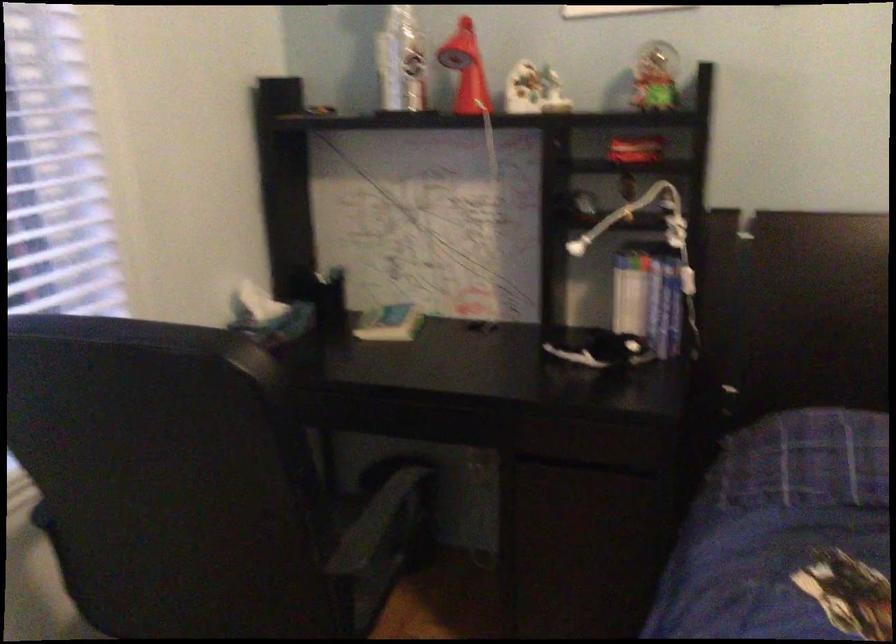
I want to click on tissue box, so click(629, 301).